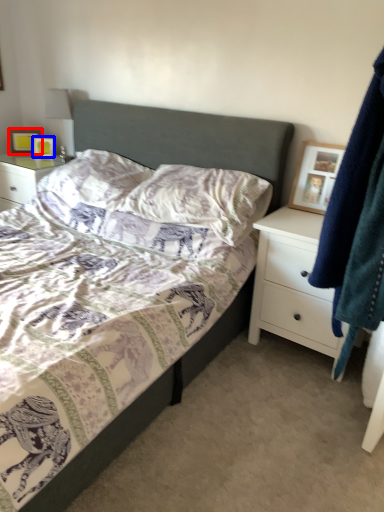
Question: Among these objects, which one is nearest to the camera, picture frame (highlighted by a red box) or picture frame (highlighted by a blue box)?

Choices:
 (A) picture frame
 (B) picture frame

Answer: (B)